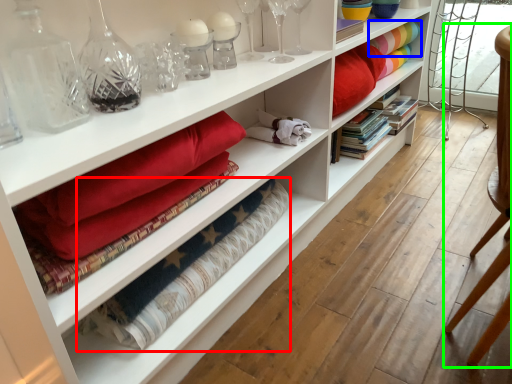
Question: Estimate the real-world distances between objects in this image. Which object is farther from material (highlighted by a red box), fabric (highlighted by a blue box) or armchair (highlighted by a green box)?

Choices:
 (A) fabric
 (B) armchair

Answer: (A)